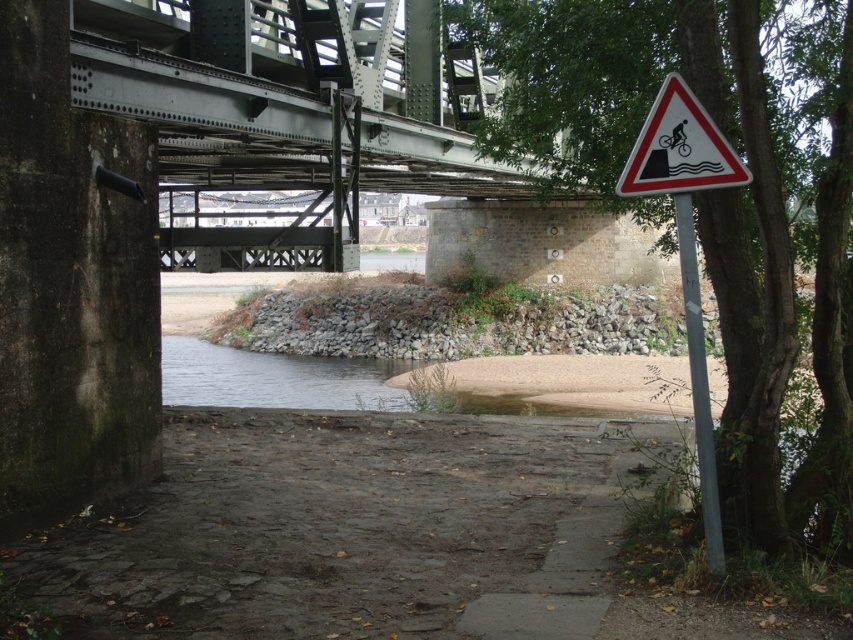
Question: From the image, what is the correct spatial relationship of white triangular sign with black and red at right in relation to white metallic pole at right?

Choices:
 (A) left
 (B) right

Answer: (A)

Question: Which point is closer to the camera taking this photo?

Choices:
 (A) (723, 177)
 (B) (654, 156)
 (C) (728, 340)
 (D) (704, 476)

Answer: (A)

Question: Which of the following is the farthest from the observer?

Choices:
 (A) pyautogui.click(x=715, y=145)
 (B) pyautogui.click(x=808, y=164)
 (C) pyautogui.click(x=704, y=387)
 (D) pyautogui.click(x=743, y=180)

Answer: (B)

Question: Is white plastic triangle at right above white metallic pole at right?

Choices:
 (A) no
 (B) yes

Answer: (B)

Question: Which point appears closest to the camera in this image?

Choices:
 (A) (699, 310)
 (B) (590, 173)
 (C) (683, 148)
 (D) (695, 413)

Answer: (C)

Question: Does white plastic triangle at right lie in front of white triangular sign with black and red at right?

Choices:
 (A) yes
 (B) no

Answer: (A)